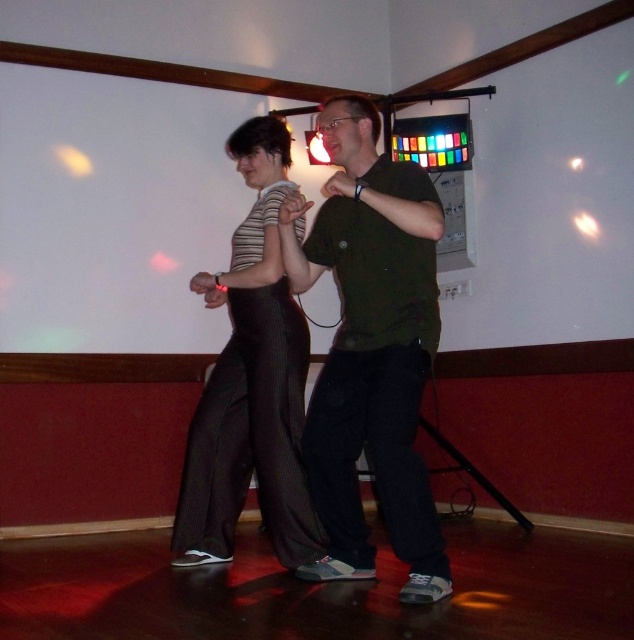
Question: Is green matte shirt at center smaller than striped fabric pants at center?

Choices:
 (A) yes
 (B) no

Answer: (A)

Question: Observing the image, what is the correct spatial positioning of green matte shirt at center in reference to striped fabric pants at center?

Choices:
 (A) above
 (B) below

Answer: (B)

Question: Is green matte shirt at center closer to camera compared to striped fabric pants at center?

Choices:
 (A) no
 (B) yes

Answer: (B)

Question: Among these objects, which one is nearest to the camera?

Choices:
 (A) green matte shirt at center
 (B) striped fabric pants at center

Answer: (A)

Question: Among these points, which one is nearest to the camera?

Choices:
 (A) (408, 228)
 (B) (221, 296)

Answer: (A)